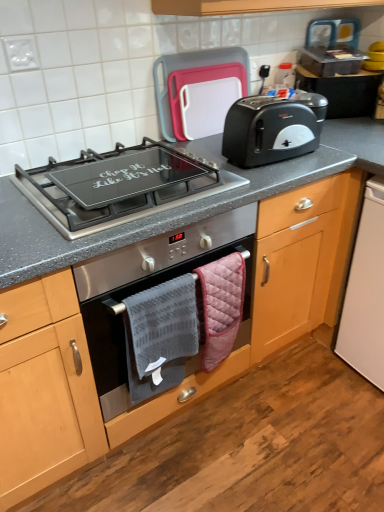
Question: From the image's perspective, is white plastic dishwasher at lower right, marked as the first appliance in a bottom-to-top arrangement, positioned above or below pink quilted hand towel at lower center, the 1th hand towel viewed from the right?

Choices:
 (A) below
 (B) above

Answer: (B)

Question: Considering the positions of white plastic dishwasher at lower right, which is counted as the 2th appliance, starting from the top, and pink quilted hand towel at lower center, the 1th hand towel viewed from the right, in the image, is white plastic dishwasher at lower right, which is counted as the 2th appliance, starting from the top, wider or thinner than pink quilted hand towel at lower center, the 1th hand towel viewed from the right,?

Choices:
 (A) wide
 (B) thin

Answer: (A)

Question: Considering the real-world distances, which object is closest to the white plastic dishwasher at lower right, marked as the first appliance in a bottom-to-top arrangement?

Choices:
 (A) black plastic toaster at upper right
 (B) stainless steel oven at center
 (C) pink quilted hand towel at lower center, the 1th hand towel viewed from the right
 (D) gray textured towel at center, which is the 2th hand towel from right to left
 (E) metallic silver toaster at upper right, the 1th appliance in the top-to-bottom sequence

Answer: (A)

Question: Estimate the real-world distances between objects in this image. Which object is farther from the plastic cutting board at upper center?

Choices:
 (A) gray textured towel at center, which is the 2th hand towel from right to left
 (B) stainless steel oven at center
 (C) metallic silver toaster at upper right, which ranks as the second appliance in bottom-to-top order
 (D) black plastic toaster at upper right
 (E) black glass cooktop at center

Answer: (A)